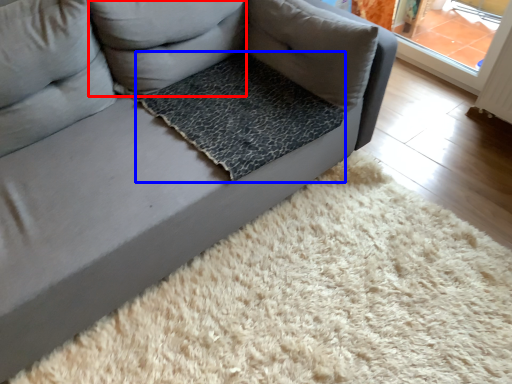
Question: Which object is further to the camera taking this photo, pillow (highlighted by a red box) or dog bed (highlighted by a blue box)?

Choices:
 (A) pillow
 (B) dog bed

Answer: (B)